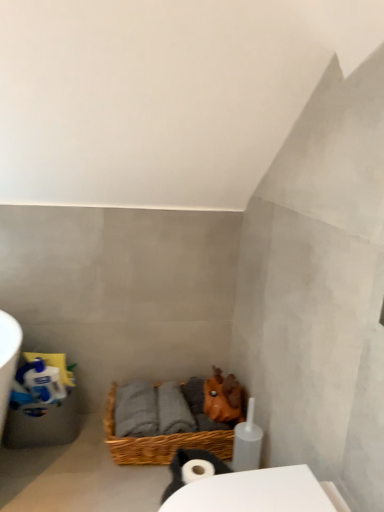
Measure the distance between point (x=180, y=451) and camera.

The depth of point (x=180, y=451) is 1.43 meters.

Identify the location of white matte toilet paper roll at lower center. (187, 461).

The height and width of the screenshot is (512, 384). Describe the element at coordinates (187, 461) in the screenshot. I see `white matte toilet paper roll at lower center` at that location.

You are a GUI agent. You are given a task and a screenshot of the screen. Output one action in this format:
    pyautogui.click(x=<x>, y=<y>)
    Task: Click on the woven brown basket at lower center
    
    Given the screenshot: What is the action you would take?
    pyautogui.click(x=160, y=442)

The width and height of the screenshot is (384, 512). What do you see at coordinates (160, 442) in the screenshot?
I see `woven brown basket at lower center` at bounding box center [160, 442].

Locate an element on the screen. white matte toilet paper roll at lower center is located at coordinates (187, 461).

Does white matte toilet paper roll at lower center appear on the right side of woven brown basket at lower center?

Yes.

Considering the relative positions of white matte toilet paper roll at lower center and woven brown basket at lower center in the image provided, is white matte toilet paper roll at lower center behind woven brown basket at lower center?

No, white matte toilet paper roll at lower center is in front of woven brown basket at lower center.

Which is in front, point (217, 471) or point (111, 447)?

The point (217, 471) is closer.

From the image's perspective, which one is positioned lower, white matte toilet paper roll at lower center or woven brown basket at lower center?

white matte toilet paper roll at lower center.

From a real-world perspective, is white matte toilet paper roll at lower center above or below woven brown basket at lower center?

white matte toilet paper roll at lower center is above woven brown basket at lower center.

Looking at their sizes, would you say white matte toilet paper roll at lower center is wider or thinner than woven brown basket at lower center?

In the image, white matte toilet paper roll at lower center appears to be more narrow than woven brown basket at lower center.

Which of these two, white matte toilet paper roll at lower center or woven brown basket at lower center, stands taller?

With more height is woven brown basket at lower center.

Based on the photo, does white matte toilet paper roll at lower center have a smaller size compared to woven brown basket at lower center?

Yes.

Would you say white matte toilet paper roll at lower center is inside or outside woven brown basket at lower center?

white matte toilet paper roll at lower center cannot be found inside woven brown basket at lower center.

Is white matte toilet paper roll at lower center beside woven brown basket at lower center?

No, white matte toilet paper roll at lower center is not next to woven brown basket at lower center.

Does white matte toilet paper roll at lower center turn towards woven brown basket at lower center?

No, white matte toilet paper roll at lower center is not facing towards woven brown basket at lower center.

Locate an element on the screen. This screenshot has height=512, width=384. basket that appears above the white matte toilet paper roll at lower center (from the image's perspective) is located at coordinates (160, 442).

Considering the relative positions of woven brown basket at lower center and white matte toilet paper roll at lower center in the image provided, is woven brown basket at lower center to the left of white matte toilet paper roll at lower center from the viewer's perspective?

Correct, you'll find woven brown basket at lower center to the left of white matte toilet paper roll at lower center.

Is woven brown basket at lower center closer to camera compared to white matte toilet paper roll at lower center?

No, it is not.

Is point (155, 458) positioned in front of point (167, 494)?

No, (155, 458) is behind (167, 494).

From the image's perspective, between woven brown basket at lower center and white matte toilet paper roll at lower center, which one is located above?

woven brown basket at lower center appears higher in the image.

From a real-world perspective, who is located lower, woven brown basket at lower center or white matte toilet paper roll at lower center?

woven brown basket at lower center, from a real-world perspective.

Considering the sizes of objects woven brown basket at lower center and white matte toilet paper roll at lower center in the image provided, who is thinner, woven brown basket at lower center or white matte toilet paper roll at lower center?

Thinner between the two is white matte toilet paper roll at lower center.

Who is shorter, woven brown basket at lower center or white matte toilet paper roll at lower center?

With less height is white matte toilet paper roll at lower center.

Does woven brown basket at lower center have a smaller size compared to white matte toilet paper roll at lower center?

No, woven brown basket at lower center is not smaller than white matte toilet paper roll at lower center.

Can we say woven brown basket at lower center lies outside white matte toilet paper roll at lower center?

woven brown basket at lower center lies outside white matte toilet paper roll at lower center's area.

Are woven brown basket at lower center and white matte toilet paper roll at lower center beside each other?

No, woven brown basket at lower center is not with white matte toilet paper roll at lower center.

Is woven brown basket at lower center oriented towards white matte toilet paper roll at lower center?

No, woven brown basket at lower center does not turn towards white matte toilet paper roll at lower center.

This screenshot has width=384, height=512. I want to click on basket behind the white matte toilet paper roll at lower center, so click(x=160, y=442).

What are the coordinates of `animal lying on the right of woven brown basket at lower center` in the screenshot? It's located at (187, 461).

Where is `basket behind the white matte toilet paper roll at lower center`? The width and height of the screenshot is (384, 512). basket behind the white matte toilet paper roll at lower center is located at coordinates [160, 442].